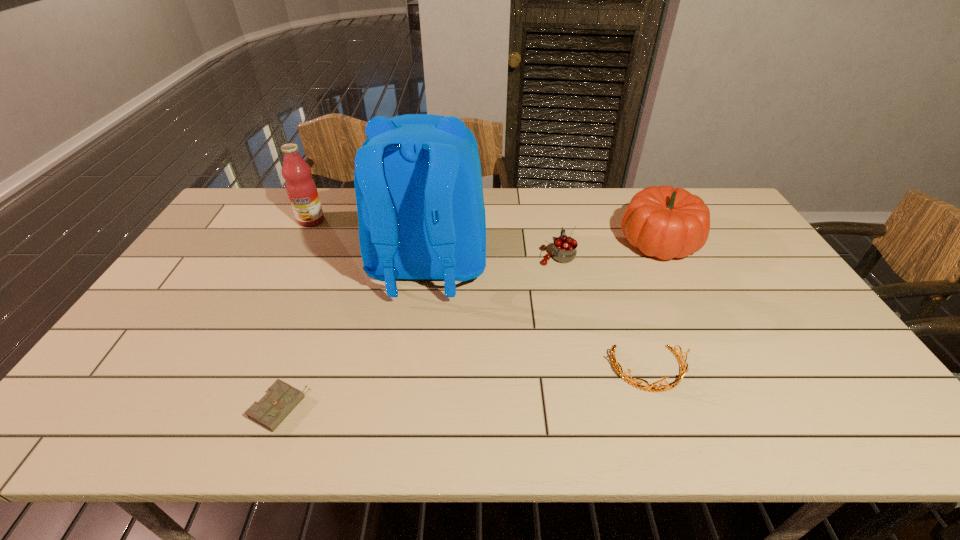
This screenshot has width=960, height=540. What are the coordinates of `object that is the fifth nearest to the fifth shortest object` in the screenshot? It's located at (633, 382).

Identify which object is the closest to the fourth object from left to right. Please provide its 2D coordinates. Your answer should be formatted as a tuple, i.e. [(x, y)], where the tuple contains the x and y coordinates of a point satisfying the conditions above.

[(664, 222)]

I want to click on vacant space that satisfies the following two spatial constraints: 1. on the label of the leftmost object; 2. on the right side of the pumpkin, so click(300, 241).

Locate an element on the screen. This screenshot has height=540, width=960. vacant point that satisfies the following two spatial constraints: 1. on the label of the diary; 2. on the left side of the leftmost object is located at coordinates (218, 409).

I want to click on vacant area that satisfies the following two spatial constraints: 1. on the handle side of the fourth shortest object; 2. on the left side of the fourth tallest object, so click(554, 241).

I want to click on vacant space that satisfies the following two spatial constraints: 1. on the label of the fruit juice; 2. on the right side of the pumpkin, so click(300, 241).